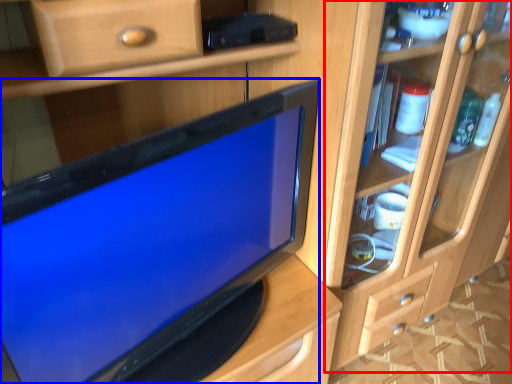
Question: Which object appears closest to the camera in this image, dresser (highlighted by a red box) or television (highlighted by a blue box)?

Choices:
 (A) dresser
 (B) television

Answer: (B)